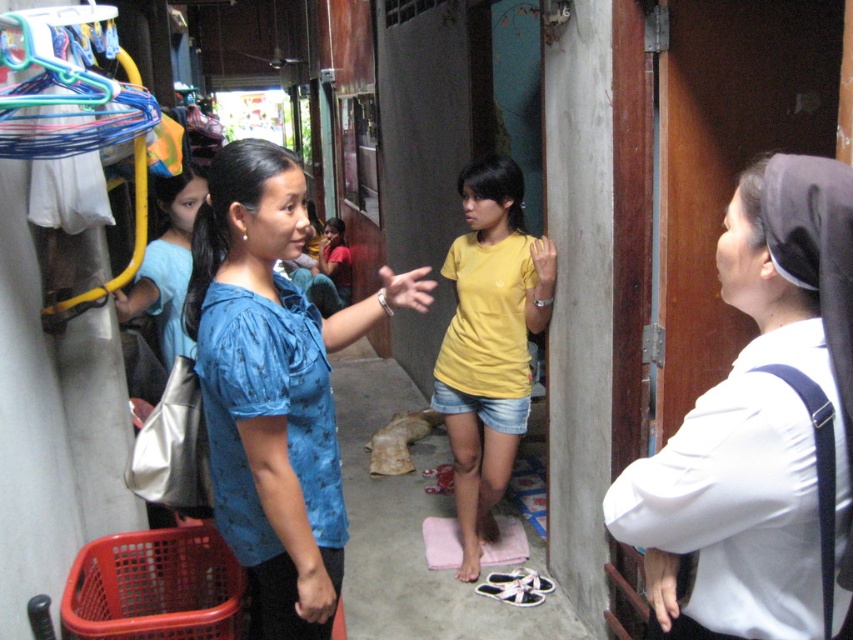
Question: Is blue printed blouse at center positioned in front of yellow matte shirt at center?

Choices:
 (A) yes
 (B) no

Answer: (A)

Question: Which object is the farthest from the blue printed blouse at center?

Choices:
 (A) white smooth uniform at right
 (B) yellow matte shirt at center

Answer: (B)

Question: Does white smooth uniform at right appear under blue printed blouse at center?

Choices:
 (A) yes
 (B) no

Answer: (B)

Question: Which of the following is the farthest from the observer?

Choices:
 (A) yellow matte shirt at center
 (B) white smooth uniform at right
 (C) blue printed blouse at center

Answer: (A)

Question: Which point appears closest to the camera in this image?

Choices:
 (A) (308, 486)
 (B) (851, 330)
 (C) (451, 253)

Answer: (B)

Question: Can you confirm if white smooth uniform at right is wider than yellow matte shirt at center?

Choices:
 (A) no
 (B) yes

Answer: (A)